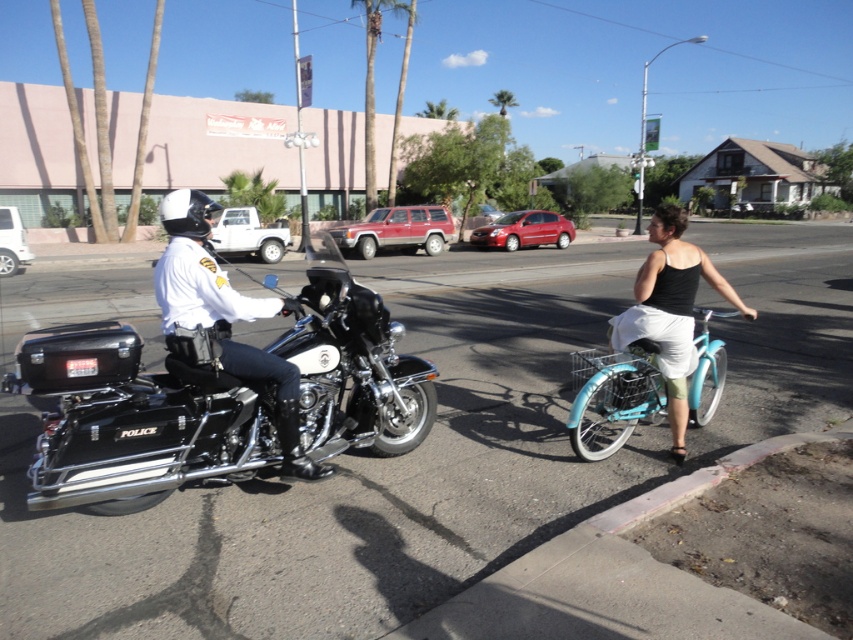
Question: Which object is the farthest from the black glossy motorcycle at left?

Choices:
 (A) black polished police motorcycle at left
 (B) teal matte bicycle at center

Answer: (B)

Question: Is black polished police motorcycle at left to the left of black glossy motorcycle at left from the viewer's perspective?

Choices:
 (A) no
 (B) yes

Answer: (A)

Question: Considering the relative positions of black polished police motorcycle at left and black glossy motorcycle at left in the image provided, where is black polished police motorcycle at left located with respect to black glossy motorcycle at left?

Choices:
 (A) right
 (B) left

Answer: (A)

Question: Which object is the farthest from the teal matte bicycle at center?

Choices:
 (A) black glossy motorcycle at left
 (B) black polished police motorcycle at left

Answer: (A)

Question: Is black polished police motorcycle at left smaller than black glossy motorcycle at left?

Choices:
 (A) yes
 (B) no

Answer: (A)

Question: Among these objects, which one is farthest from the camera?

Choices:
 (A) black glossy motorcycle at left
 (B) black polished police motorcycle at left
 (C) teal matte bicycle at center

Answer: (C)